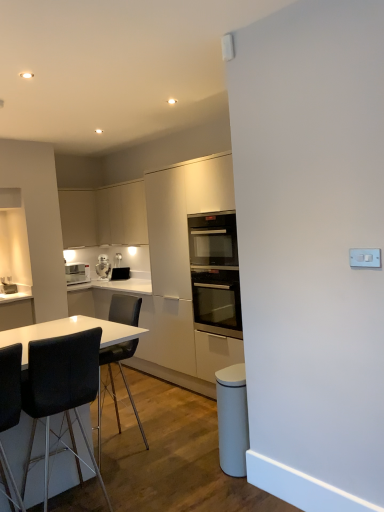
Question: Is white glossy microwave at upper left, which is counted as the 1th appliance, starting from the left, next to matte black toaster at center, the first appliance viewed from the right?

Choices:
 (A) yes
 (B) no

Answer: (B)

Question: From the image's perspective, is white glossy microwave at upper left, which is counted as the 1th appliance, starting from the left, below matte black toaster at center, which is the 2th appliance from left to right?

Choices:
 (A) yes
 (B) no

Answer: (B)

Question: Is matte black toaster at center, which is the 2th appliance from left to right, located within white glossy microwave at upper left, the second appliance viewed from the right?

Choices:
 (A) no
 (B) yes

Answer: (A)

Question: Considering the relative sizes of white glossy microwave at upper left, which is counted as the 1th appliance, starting from the left, and matte black toaster at center, the first appliance viewed from the right, in the image provided, is white glossy microwave at upper left, which is counted as the 1th appliance, starting from the left, bigger than matte black toaster at center, the first appliance viewed from the right,?

Choices:
 (A) yes
 (B) no

Answer: (A)

Question: Is white glossy microwave at upper left, the second appliance viewed from the right, thinner than matte black toaster at center, which is the 2th appliance from left to right?

Choices:
 (A) no
 (B) yes

Answer: (A)

Question: Is matte white cabinet at upper left, marked as the second cabinetry in a right-to-left arrangement, in front of or behind black leather chair at lower left, which appears as the 1th chair when viewed from the front, in the image?

Choices:
 (A) behind
 (B) front

Answer: (A)

Question: Is matte white cabinet at upper left, marked as the second cabinetry in a right-to-left arrangement, wider or thinner than black leather chair at lower left, which is counted as the third chair, starting from the back?

Choices:
 (A) thin
 (B) wide

Answer: (A)

Question: Based on their sizes in the image, would you say matte white cabinet at upper left, the first cabinetry from the left, is bigger or smaller than black leather chair at lower left, which is counted as the third chair, starting from the back?

Choices:
 (A) small
 (B) big

Answer: (B)

Question: Is point (87, 199) closer or farther from the camera than point (13, 350)?

Choices:
 (A) farther
 (B) closer

Answer: (A)

Question: Would you say matte black toaster at center, which is the 2th appliance from left to right, is inside or outside black glass oven at center?

Choices:
 (A) outside
 (B) inside

Answer: (A)

Question: Is matte black toaster at center, which is the 2th appliance from left to right, wider or thinner than black glass oven at center?

Choices:
 (A) thin
 (B) wide

Answer: (A)

Question: Is matte black toaster at center, the first appliance viewed from the right, bigger or smaller than black glass oven at center?

Choices:
 (A) small
 (B) big

Answer: (A)

Question: From a real-world perspective, is matte black toaster at center, which is the 2th appliance from left to right, physically located above or below black glass oven at center?

Choices:
 (A) below
 (B) above

Answer: (A)

Question: Which is correct: white glossy microwave at upper left, the second appliance viewed from the right, is inside matte white cabinet at upper left, the first cabinetry from the left, or outside of it?

Choices:
 (A) inside
 (B) outside

Answer: (B)

Question: Is point (97, 273) closer or farther from the camera than point (87, 245)?

Choices:
 (A) farther
 (B) closer

Answer: (B)